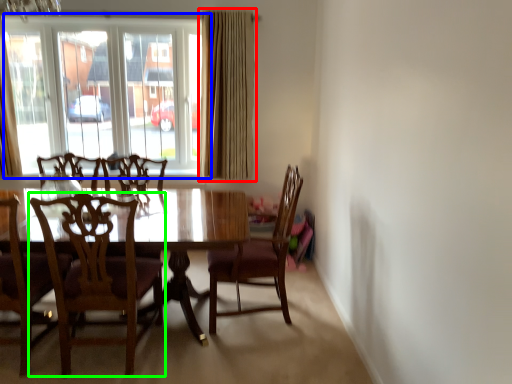
Question: Which object is positioned closest to curtain (highlighted by a red box)? Select from window (highlighted by a blue box) and chair (highlighted by a green box).

Choices:
 (A) window
 (B) chair

Answer: (A)